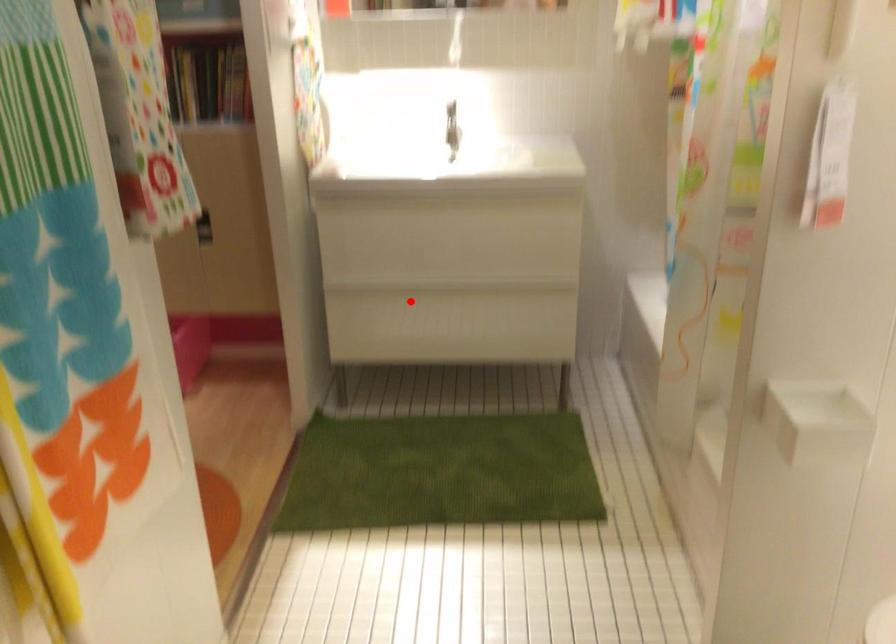
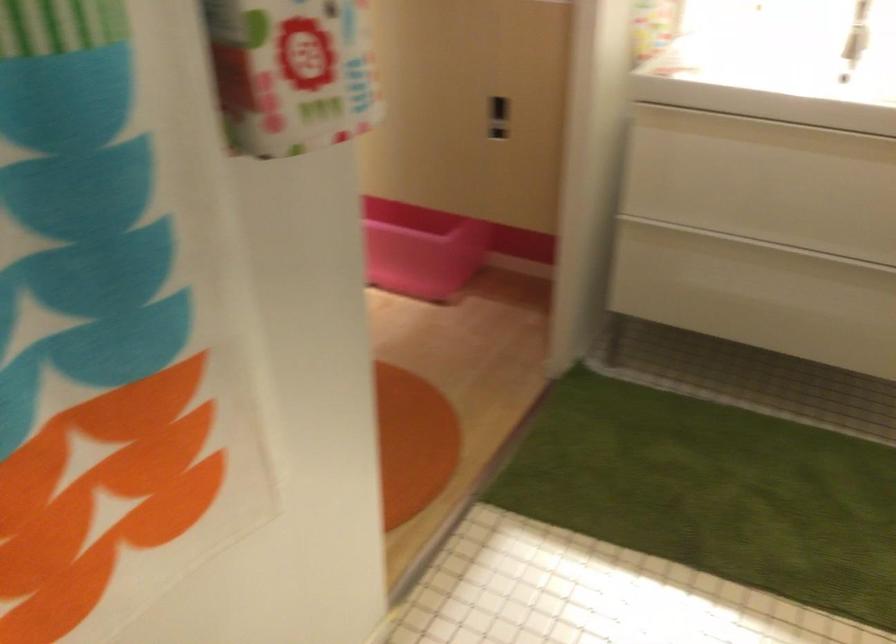
Question: I am providing you with two images of the same scene from different viewpoints. Image1 has a red point marked. In image2, the corresponding 3D location appears at what relative position? Reply with the corresponding letter.

Choices:
 (A) Closer
 (B) Farther

Answer: (A)